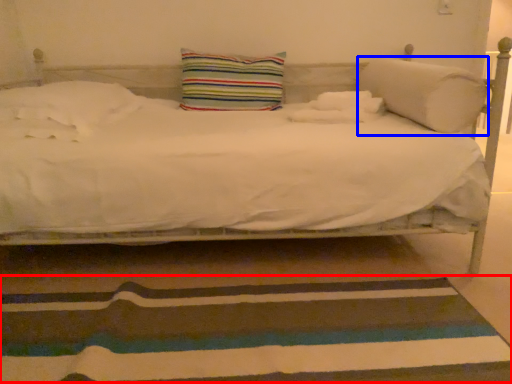
Question: Which of the following is the closest to the observer, doormat (highlighted by a red box) or pillow (highlighted by a blue box)?

Choices:
 (A) doormat
 (B) pillow

Answer: (A)